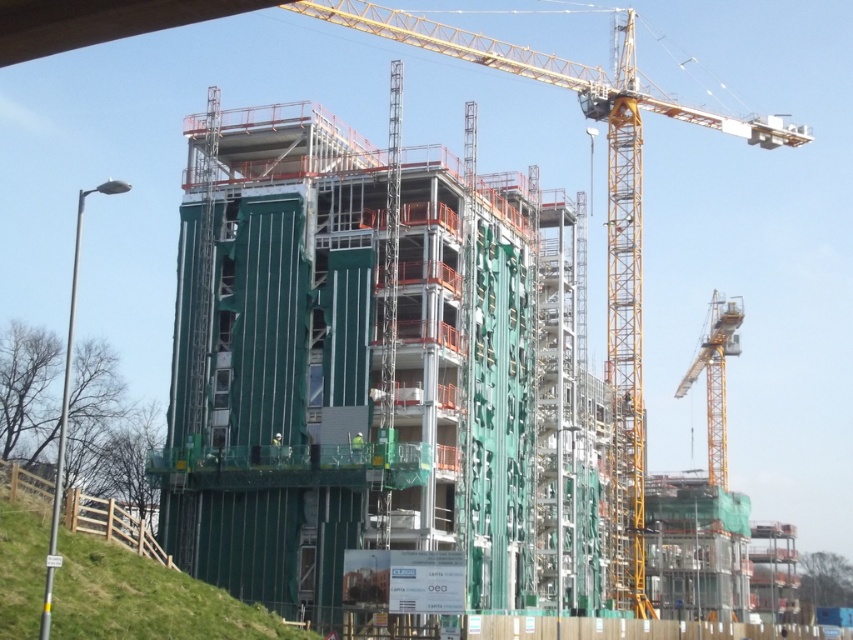
You are a construction worker standing at the yellow metallic crane at right. You need to walk to the green grass at lower left for a break. Which direction should you head towards?

You should head to the left to reach the green grass at lower left from the yellow metallic crane at right.